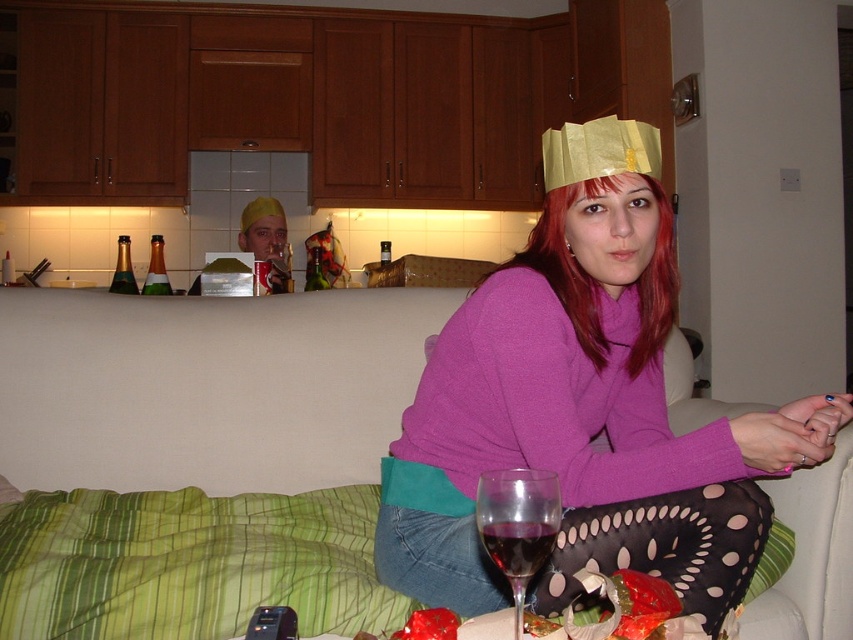
Can you confirm if dark purple glass at lower center is positioned above matte yellow cap at center?

Incorrect, dark purple glass at lower center is not positioned above matte yellow cap at center.

Describe the element at coordinates (517, 545) in the screenshot. I see `dark purple glass at lower center` at that location.

Does point (482, 534) come closer to viewer compared to point (273, 202)?

That is True.

The image size is (853, 640). I want to click on dark purple glass at lower center, so click(517, 545).

Can you confirm if transparent glass at lower center is wider than matte yellow cap at center?

No.

Which is more to the right, transparent glass at lower center or matte yellow cap at center?

From the viewer's perspective, transparent glass at lower center appears more on the right side.

Does point (550, 544) lie behind point (270, 234)?

No, it is not.

The height and width of the screenshot is (640, 853). What are the coordinates of `transparent glass at lower center` in the screenshot? It's located at (518, 525).

Between point (555, 138) and point (264, 204), which one is positioned behind?

The point (264, 204) is behind.

Does point (631, 166) come in front of point (281, 240)?

Yes, it is.

Where is `gold paper crown at upper center`? gold paper crown at upper center is located at coordinates (599, 150).